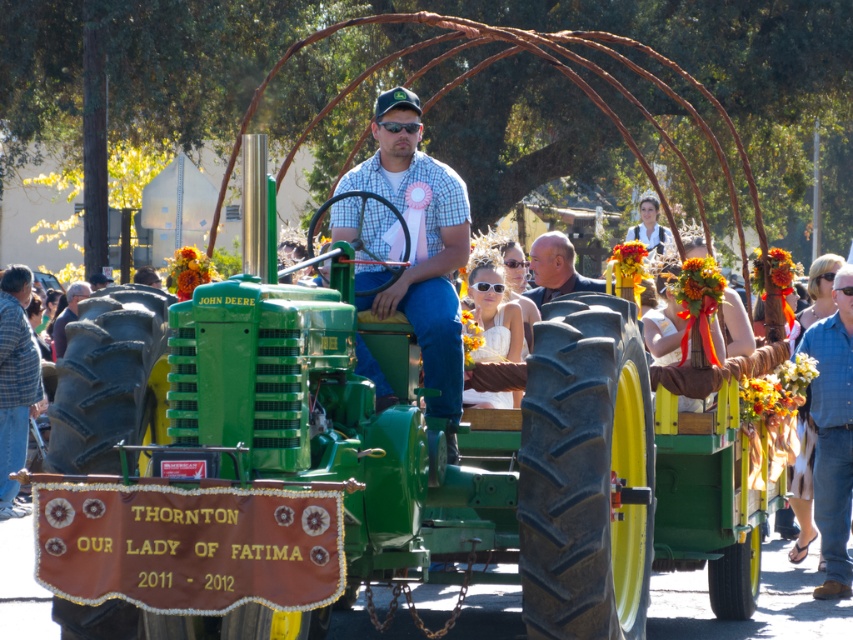
Who is lower down, checkered fabric shirt at center or smooth brown leather jacket at center?

Positioned lower is checkered fabric shirt at center.

Where is `checkered fabric shirt at center`? checkered fabric shirt at center is located at coordinates (418, 243).

Does point (27, 362) lie in front of point (570, 244)?

No, (27, 362) is behind (570, 244).

Which is above, blue plaid shirt at left or smooth brown leather jacket at center?

smooth brown leather jacket at center is above.

Is point (3, 516) positioned before point (595, 278)?

Yes, it is.

In order to click on blue plaid shirt at left in this screenshot , I will do `click(15, 381)`.

Is blue plaid shirt at left positioned in front of dark brown leather jacket at lower left?

Yes.

Consider the image. Which is more to the left, blue plaid shirt at left or dark brown leather jacket at lower left?

Positioned to the left is dark brown leather jacket at lower left.

Is point (21, 330) behind point (62, 332)?

No, (21, 330) is closer to viewer.

This screenshot has height=640, width=853. What are the coordinates of `blue plaid shirt at left` in the screenshot? It's located at (15, 381).